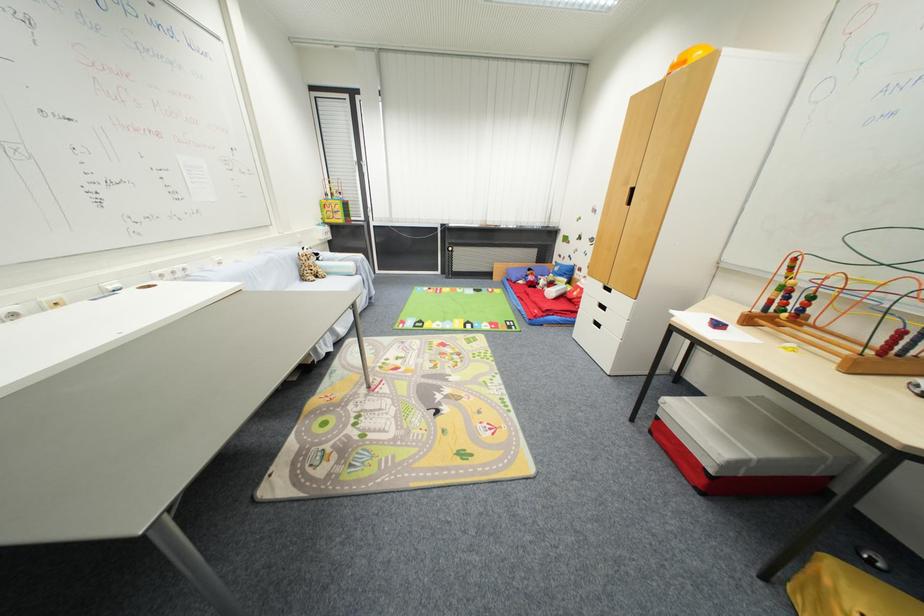
Find where to turn the activity cube toy. Please return your answer as a coordinate pair (x, y).

(402, 423)